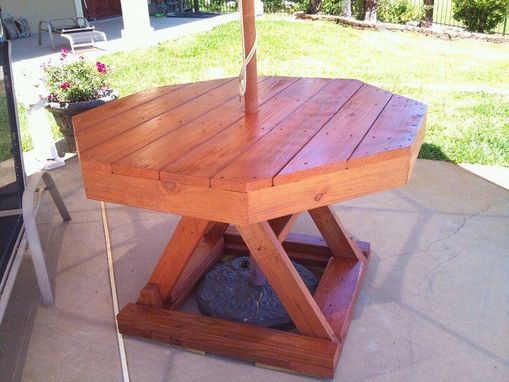
Where is `wood table`? The width and height of the screenshot is (509, 382). wood table is located at coordinates (277, 155).